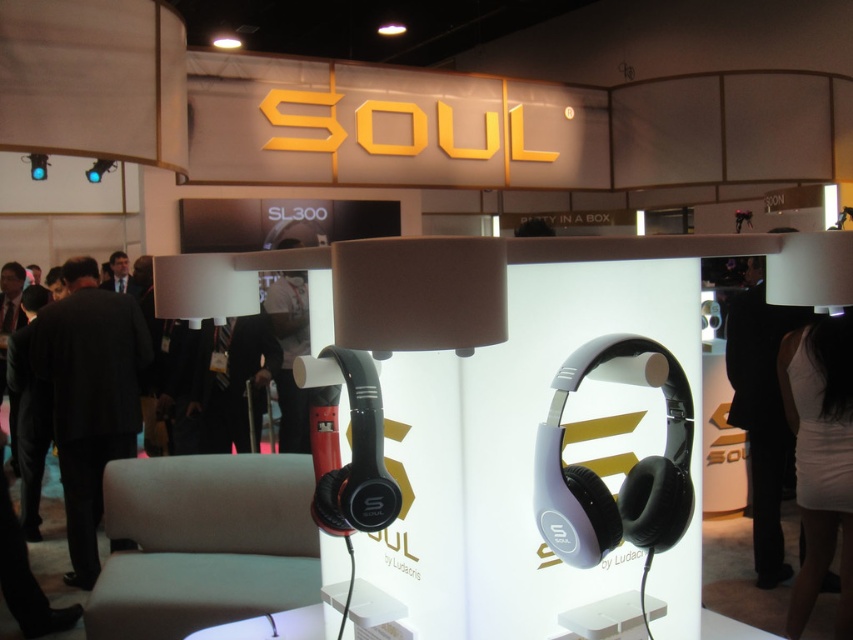
Can you confirm if white matte dress at lower right is bigger than black suit at right?

No.

Which is behind, point (839, 524) or point (747, 435)?

The point (747, 435) is more distant.

Locate an element on the screen. The height and width of the screenshot is (640, 853). white matte dress at lower right is located at coordinates (820, 458).

Is matte purple plastic headphones at center below black suit at right?

Actually, matte purple plastic headphones at center is above black suit at right.

From the picture: Which of these two, matte purple plastic headphones at center or black suit at right, stands taller?

black suit at right

In order to click on matte purple plastic headphones at center in this screenshot , I will do `click(625, 472)`.

Find the location of a particular element. The image size is (853, 640). matte purple plastic headphones at center is located at coordinates (625, 472).

Is light gray fabric stool at lower left shorter than matte purple plastic headphones at center?

No.

This screenshot has height=640, width=853. What do you see at coordinates (202, 544) in the screenshot? I see `light gray fabric stool at lower left` at bounding box center [202, 544].

The height and width of the screenshot is (640, 853). In order to click on light gray fabric stool at lower left in this screenshot , I will do `click(202, 544)`.